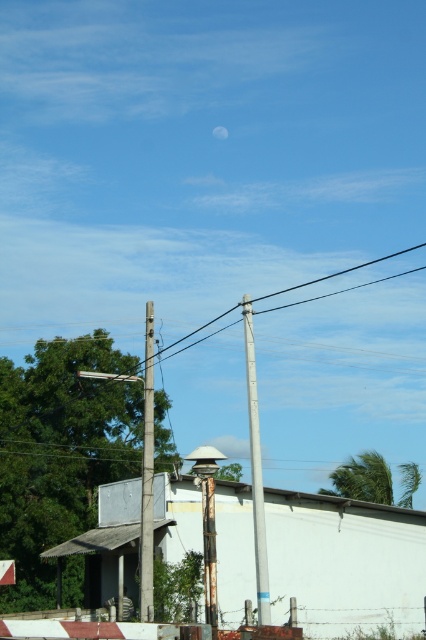
Can you confirm if metallic gray telegraph pole at center is shorter than smooth gray pole at left?

Correct, metallic gray telegraph pole at center is not as tall as smooth gray pole at left.

Between point (247, 328) and point (144, 554), which one is positioned behind?

The point (144, 554) is more distant.

This screenshot has height=640, width=426. In order to click on metallic gray telegraph pole at center in this screenshot , I will do `click(256, 470)`.

I want to click on metallic gray telegraph pole at center, so click(x=256, y=470).